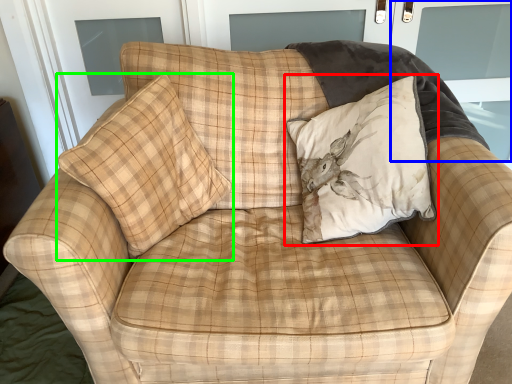
Question: Considering the real-world distances, which object is farthest from pillow (highlighted by a red box)? screen door (highlighted by a blue box) or pillow (highlighted by a green box)?

Choices:
 (A) screen door
 (B) pillow

Answer: (A)